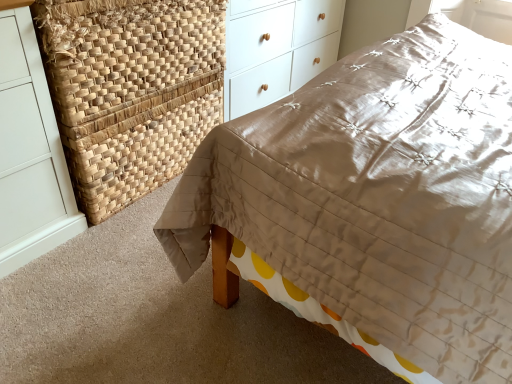
Question: Is white wood chest of drawers at upper center at the right side of natural woven basket at upper left?

Choices:
 (A) yes
 (B) no

Answer: (A)

Question: Is white wood chest of drawers at upper center next to natural woven basket at upper left and touching it?

Choices:
 (A) no
 (B) yes

Answer: (A)

Question: Is white wood chest of drawers at upper center to the left of natural woven basket at upper left from the viewer's perspective?

Choices:
 (A) no
 (B) yes

Answer: (A)

Question: Is white wood chest of drawers at upper center thinner than natural woven basket at upper left?

Choices:
 (A) yes
 (B) no

Answer: (B)

Question: Is white wood chest of drawers at upper center looking in the opposite direction of natural woven basket at upper left?

Choices:
 (A) no
 (B) yes

Answer: (A)

Question: Does white wood chest of drawers at upper center have a larger size compared to natural woven basket at upper left?

Choices:
 (A) yes
 (B) no

Answer: (A)

Question: Is natural woven basket at upper left looking in the opposite direction of white wood chest of drawers at upper center?

Choices:
 (A) yes
 (B) no

Answer: (B)

Question: From the image's perspective, would you say natural woven basket at upper left is positioned over white wood chest of drawers at upper center?

Choices:
 (A) yes
 (B) no

Answer: (B)

Question: From a real-world perspective, is natural woven basket at upper left physically above white wood chest of drawers at upper center?

Choices:
 (A) yes
 (B) no

Answer: (B)

Question: Is natural woven basket at upper left taller than white wood chest of drawers at upper center?

Choices:
 (A) yes
 (B) no

Answer: (B)

Question: Is natural woven basket at upper left positioned beyond the bounds of white wood chest of drawers at upper center?

Choices:
 (A) yes
 (B) no

Answer: (A)

Question: Can you confirm if natural woven basket at upper left is wider than white wood chest of drawers at upper center?

Choices:
 (A) no
 (B) yes

Answer: (A)

Question: Considering the relative sizes of matte brown quilt at center and natural woven basket at upper left in the image provided, is matte brown quilt at center wider than natural woven basket at upper left?

Choices:
 (A) no
 (B) yes

Answer: (B)